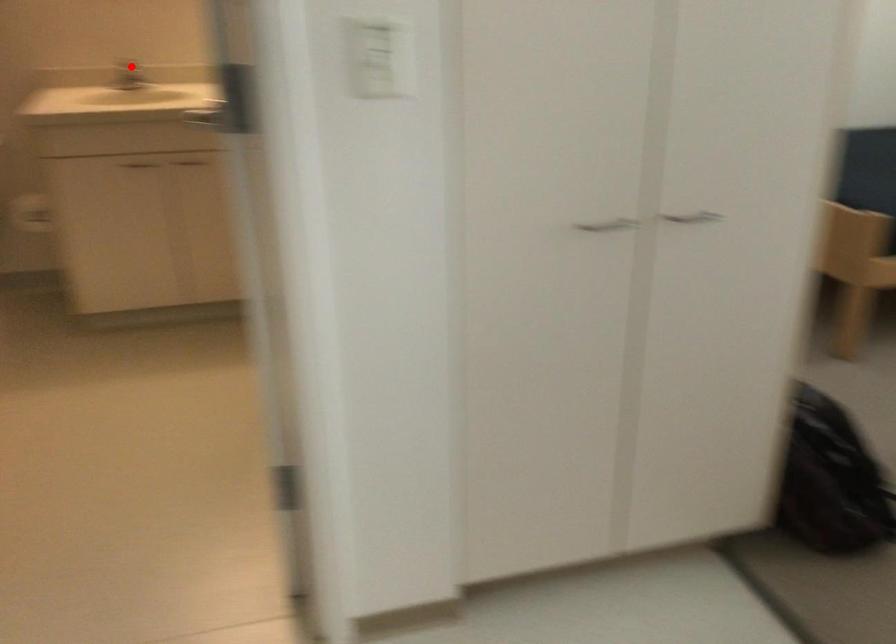
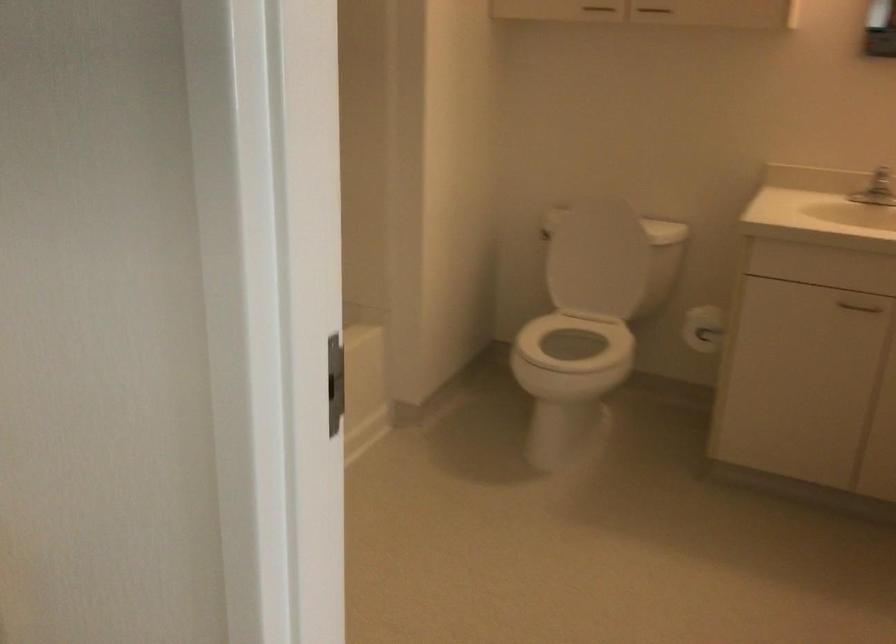
Question: A red point is marked in image1. In image2, is the corresponding 3D point closer to the camera or farther? Reply with the corresponding letter.

Choices:
 (A) The corresponding 3D point is closer.
 (B) The corresponding 3D point is farther.

Answer: (A)